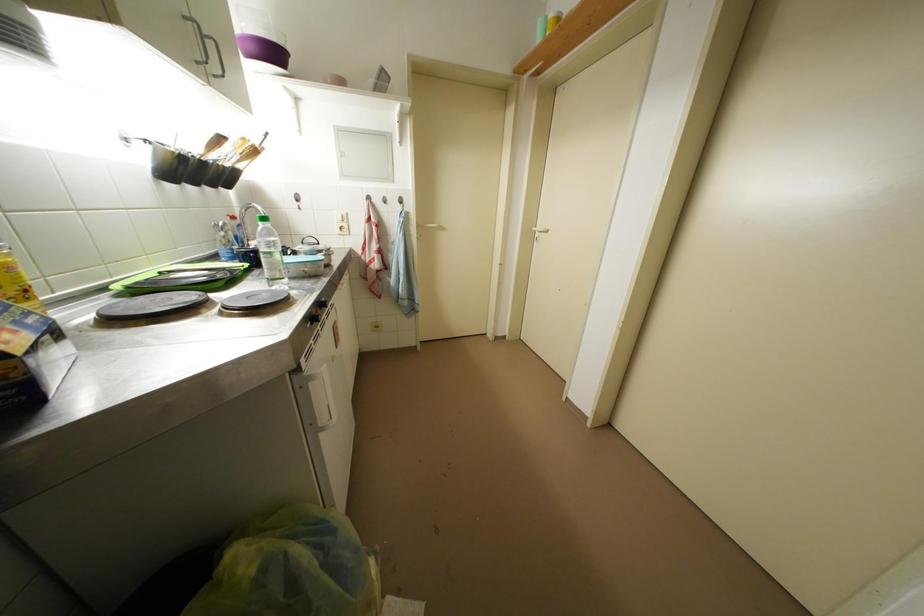
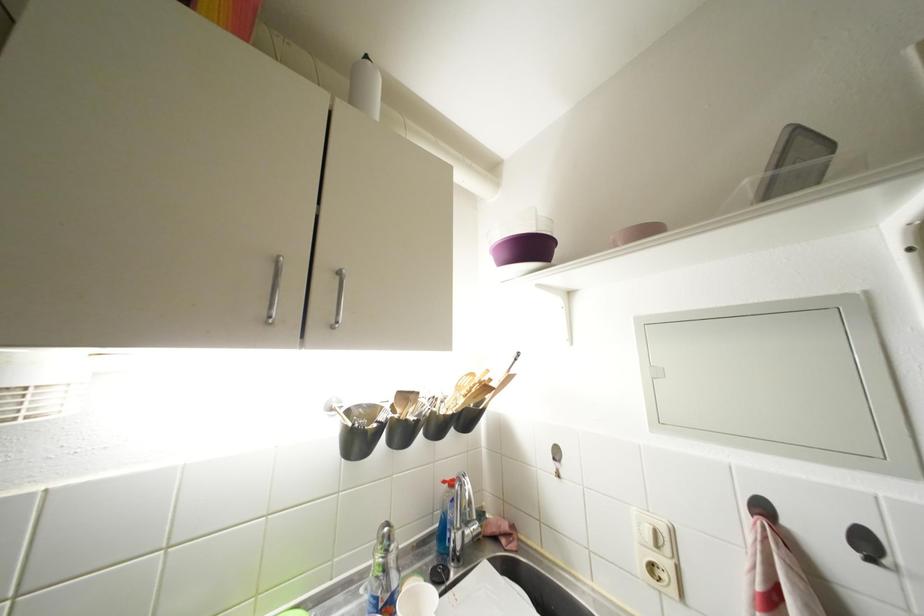
Locate, in the second image, the point that corresponds to the point at 239,222 in the first image.

(457, 488)